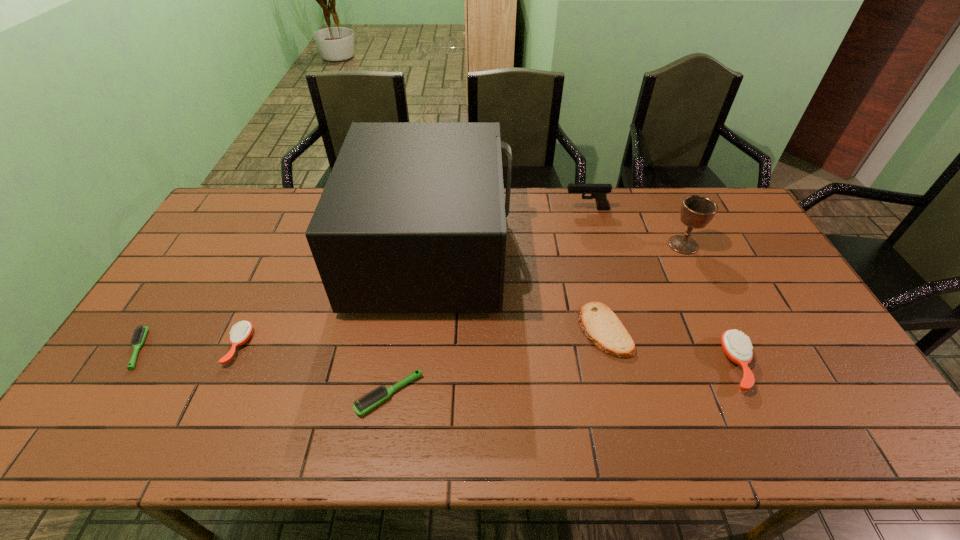
Identify which hairbrush is the fourth closest to the chalice. Please provide its 2D coordinates. Your answer should be formatted as a tuple, i.e. [(x, y)], where the tuple contains the x and y coordinates of a point satisfying the conditions above.

[(139, 335)]

I want to click on hairbrush identified as the closest to the bigger orange hairbrush, so click(x=373, y=398).

Locate an element on the screen. The height and width of the screenshot is (540, 960). free space that satisfies the following two spatial constraints: 1. on the front-facing side of the pistol; 2. on the right side of the chalice is located at coordinates (596, 245).

You are a GUI agent. You are given a task and a screenshot of the screen. Output one action in this format:
    pyautogui.click(x=<x>, y=<y>)
    Task: Click on the free region that satisfies the following two spatial constraints: 1. on the front side of the fifth shortest object; 2. on the left side of the smaller orange hairbrush
    This screenshot has height=540, width=960.
    Given the screenshot: What is the action you would take?
    pyautogui.click(x=231, y=364)

You are a GUI agent. You are given a task and a screenshot of the screen. Output one action in this format:
    pyautogui.click(x=<x>, y=<y>)
    Task: Click on the free location that satisfies the following two spatial constraints: 1. on the back side of the chalice; 2. on the right side of the third hairbrush from right to left
    
    Given the screenshot: What is the action you would take?
    pyautogui.click(x=286, y=245)

You are a GUI agent. You are given a task and a screenshot of the screen. Output one action in this format:
    pyautogui.click(x=<x>, y=<y>)
    Task: Click on the free space that satisfies the following two spatial constraints: 1. on the front-facing side of the microwave oven; 2. on the front side of the left orange hairbrush
    The height and width of the screenshot is (540, 960).
    Given the screenshot: What is the action you would take?
    pyautogui.click(x=422, y=346)

Where is `vacant space that satisfies the following two spatial constraints: 1. on the front-facing side of the microwave oven; 2. on the left side of the tallest hairbrush`? Image resolution: width=960 pixels, height=540 pixels. vacant space that satisfies the following two spatial constraints: 1. on the front-facing side of the microwave oven; 2. on the left side of the tallest hairbrush is located at coordinates (420, 364).

This screenshot has width=960, height=540. In order to click on vacant space that satisfies the following two spatial constraints: 1. on the front side of the seventh shortest object; 2. on the front-facing side of the tallest object in this screenshot , I will do `click(686, 252)`.

Where is `vacant space that satisfies the following two spatial constraints: 1. on the back side of the second hairbrush from right to left; 2. on the left side of the pita bread`? vacant space that satisfies the following two spatial constraints: 1. on the back side of the second hairbrush from right to left; 2. on the left side of the pita bread is located at coordinates (399, 330).